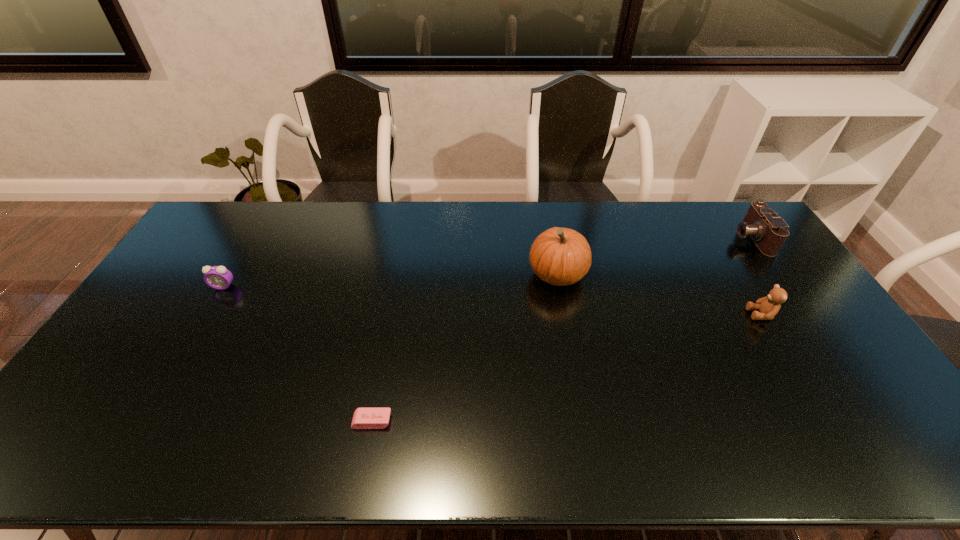
The height and width of the screenshot is (540, 960). What are the coordinates of `free point that satisfies the following two spatial constraints: 1. on the front-facing side of the camera; 2. on the face of the second shortest object` in the screenshot? It's located at (784, 286).

At what (x,y) coordinates should I click in order to perform the action: click on free region that satisfies the following two spatial constraints: 1. on the stem of the tallest object; 2. on the face of the alarm clock. Please return your answer as a coordinate pair (x, y). The image size is (960, 540). Looking at the image, I should click on (560, 286).